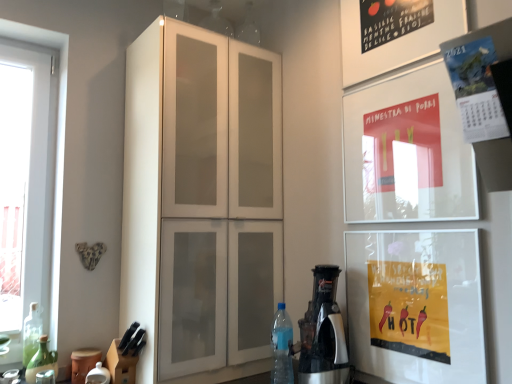
The width and height of the screenshot is (512, 384). What are the coordinates of `white matte cabinet at center` in the screenshot? It's located at (201, 200).

In order to face white glass window at left, should I rotate leftwards or rightwards?

To face it directly, rotate left by 28.444 degrees.

Describe the element at coordinates (477, 85) in the screenshot. I see `matte paper calendar at upper right, which is the first poster from front to back` at that location.

Find the location of a particular element. The image size is (512, 384). silver metallic coffee machine at lower right is located at coordinates (323, 333).

The height and width of the screenshot is (384, 512). Identify the location of blue translucent bottle at lower right, the 3th bottle viewed from the left. (282, 347).

Considering the sizes of objects matte paper poster at upper right, the 1th poster from the back, and silver metallic coffee machine at lower right in the image provided, who is thinner, matte paper poster at upper right, the 1th poster from the back, or silver metallic coffee machine at lower right?

Thinner between the two is matte paper poster at upper right, the 1th poster from the back.

The width and height of the screenshot is (512, 384). In order to click on coffee machine on the left side of matte paper poster at upper right, the 1th poster from the back in this screenshot , I will do `click(323, 333)`.

Is matte paper poster at upper right, which ranks as the second poster in front-to-back order, located outside silver metallic coffee machine at lower right?

Yes, matte paper poster at upper right, which ranks as the second poster in front-to-back order, is outside of silver metallic coffee machine at lower right.

Is blue translucent bottle at lower right, the 3th bottle viewed from the left, facing away from silver metallic coffee machine at lower right?

No, blue translucent bottle at lower right, the 3th bottle viewed from the left,'s orientation is not away from silver metallic coffee machine at lower right.

From the image's perspective, is blue translucent bottle at lower right, the 3th bottle viewed from the left, located beneath silver metallic coffee machine at lower right?

Yes, from the image's perspective, blue translucent bottle at lower right, the 3th bottle viewed from the left, is below silver metallic coffee machine at lower right.

Locate an element on the screen. The image size is (512, 384). coffee machine in front of the blue translucent bottle at lower right, the 3th bottle viewed from the left is located at coordinates (323, 333).

Considering the sizes of objects blue translucent bottle at lower right, which appears as the 1th bottle when viewed from the right, and silver metallic coffee machine at lower right in the image provided, who is bigger, blue translucent bottle at lower right, which appears as the 1th bottle when viewed from the right, or silver metallic coffee machine at lower right?

silver metallic coffee machine at lower right.

Is blue translucent bottle at lower right, which appears as the 1th bottle when viewed from the right, at the back of matte paper poster at upper right, the 1th poster from the back?

matte paper poster at upper right, the 1th poster from the back, is not turned away from blue translucent bottle at lower right, which appears as the 1th bottle when viewed from the right.

Does point (438, 80) come in front of point (288, 368)?

Yes, point (438, 80) is closer to viewer.

Between matte paper poster at upper right, which ranks as the second poster in front-to-back order, and blue translucent bottle at lower right, which appears as the 1th bottle when viewed from the right, which one has less height?

Standing shorter between the two is blue translucent bottle at lower right, which appears as the 1th bottle when viewed from the right.

Measure the distance between matte paper poster at upper right, which ranks as the second poster in front-to-back order, and blue translucent bottle at lower right, the 3th bottle viewed from the left.

matte paper poster at upper right, which ranks as the second poster in front-to-back order, and blue translucent bottle at lower right, the 3th bottle viewed from the left, are 28.86 inches apart from each other.

From a real-world perspective, is white glass window at left below silver metallic coffee machine at lower right?

No, from a real-world perspective, white glass window at left is not beneath silver metallic coffee machine at lower right.

Is white glass window at left bigger than silver metallic coffee machine at lower right?

Correct, white glass window at left is larger in size than silver metallic coffee machine at lower right.

Can we say white glass window at left lies outside silver metallic coffee machine at lower right?

white glass window at left is positioned outside silver metallic coffee machine at lower right.

Can you confirm if white glass window at left is wider than matte paper poster at upper right, the 1th poster from the back?

Correct, the width of white glass window at left exceeds that of matte paper poster at upper right, the 1th poster from the back.

How different are the orientations of white glass window at left and matte paper poster at upper right, the 1th poster from the back, in degrees?

The angle between the facing direction of white glass window at left and the facing direction of matte paper poster at upper right, the 1th poster from the back, is 88.6 degrees.

How distant is white glass window at left from matte paper poster at upper right, the 1th poster from the back?

white glass window at left is 4.80 feet from matte paper poster at upper right, the 1th poster from the back.

Based on the photo, can we say white glass window at left lies outside matte paper poster at upper right, the 1th poster from the back?

Yes, white glass window at left is not within matte paper poster at upper right, the 1th poster from the back.

Is blue translucent bottle at lower right, the 3th bottle viewed from the left, closer to camera compared to matte paper poster at upper right, which ranks as the second poster in front-to-back order?

No, the depth of blue translucent bottle at lower right, the 3th bottle viewed from the left, is greater than that of matte paper poster at upper right, which ranks as the second poster in front-to-back order.

Considering the relative sizes of blue translucent bottle at lower right, the 3th bottle viewed from the left, and matte paper poster at upper right, the 1th poster from the back, in the image provided, is blue translucent bottle at lower right, the 3th bottle viewed from the left, taller than matte paper poster at upper right, the 1th poster from the back,?

No.

What's the angular difference between blue translucent bottle at lower right, which appears as the 1th bottle when viewed from the right, and matte paper poster at upper right, the 1th poster from the back,'s facing directions?

blue translucent bottle at lower right, which appears as the 1th bottle when viewed from the right, and matte paper poster at upper right, the 1th poster from the back, are facing 0.494 degrees away from each other.

From the image's perspective, is blue translucent bottle at lower right, which appears as the 1th bottle when viewed from the right, below matte paper poster at upper right, which ranks as the second poster in front-to-back order?

Yes, from the image's perspective, blue translucent bottle at lower right, which appears as the 1th bottle when viewed from the right, is below matte paper poster at upper right, which ranks as the second poster in front-to-back order.

From a real-world perspective, is matte paper calendar at upper right, the second poster from the back, physically located above or below white matte cabinet at center?

Clearly, from a real-world perspective, matte paper calendar at upper right, the second poster from the back, is above white matte cabinet at center.

Which point is more forward, (492, 134) or (132, 123)?

Positioned in front is point (492, 134).

Is matte paper calendar at upper right, which is the first poster from front to back, shorter than white matte cabinet at center?

Correct, matte paper calendar at upper right, which is the first poster from front to back, is not as tall as white matte cabinet at center.

Where is `the 2nd poster in front when counting from the white matte cabinet at center`? The width and height of the screenshot is (512, 384). the 2nd poster in front when counting from the white matte cabinet at center is located at coordinates (477, 85).

At what (x,y) coordinates should I click in order to perform the action: click on the 1st poster in front of the silver metallic coffee machine at lower right, starting your count from the anchor. Please return your answer as a coordinate pair (x, y). Looking at the image, I should click on (407, 152).

Which bottle is the 1st one when counting from the left side of the silver metallic coffee machine at lower right? Please provide its 2D coordinates.

[(282, 347)]

Consider the image. When comparing their distances from matte paper poster at upper right, which ranks as the second poster in front-to-back order, does white glass window at left or green glass bottle at left, the 2th bottle when ordered from left to right, seem closer?

white glass window at left is positioned closer to the anchor matte paper poster at upper right, which ranks as the second poster in front-to-back order.

Based on their spatial positions, is white glass window at left or blue translucent bottle at lower right, which appears as the 1th bottle when viewed from the right, further from green glass bottle at lower left, the first bottle positioned from the left?

Based on the image, blue translucent bottle at lower right, which appears as the 1th bottle when viewed from the right, appears to be further to green glass bottle at lower left, the first bottle positioned from the left.

Which object lies nearer to the anchor point white glass window at left, white matte cabinet at center or blue translucent bottle at lower right, the 3th bottle viewed from the left?

Based on the image, white matte cabinet at center appears to be nearer to white glass window at left.

Based on their spatial positions, is green glass bottle at left, the second bottle when ordered from right to left, or matte paper calendar at upper right, the second poster from the back, closer to white glass window at left?

green glass bottle at left, the second bottle when ordered from right to left, is closer to white glass window at left.

From the image, which object appears to be farther from matte paper poster at upper right, the 1th poster from the back, blue translucent bottle at lower right, which appears as the 1th bottle when viewed from the right, or matte paper calendar at upper right, the second poster from the back?

blue translucent bottle at lower right, which appears as the 1th bottle when viewed from the right, lies further to matte paper poster at upper right, the 1th poster from the back, than the other object.

Looking at the image, which one is located further to silver metallic coffee machine at lower right, green glass bottle at lower left, the 3th bottle positioned from the right, or matte paper poster at upper right, which ranks as the second poster in front-to-back order?

green glass bottle at lower left, the 3th bottle positioned from the right.

Looking at the image, which one is located closer to blue translucent bottle at lower right, the 3th bottle viewed from the left, matte paper poster at upper right, which ranks as the second poster in front-to-back order, or green glass bottle at lower left, the 3th bottle positioned from the right?

matte paper poster at upper right, which ranks as the second poster in front-to-back order, is closer to blue translucent bottle at lower right, the 3th bottle viewed from the left.

Looking at the image, which one is located closer to green glass bottle at left, the 2th bottle when ordered from left to right, silver metallic coffee machine at lower right or green glass bottle at lower left, the first bottle positioned from the left?

green glass bottle at lower left, the first bottle positioned from the left.

At what (x,y) coordinates should I click in order to perform the action: click on poster between matte paper calendar at upper right, which is the first poster from front to back, and blue translucent bottle at lower right, which appears as the 1th bottle when viewed from the right, from top to bottom. Please return your answer as a coordinate pair (x, y). The image size is (512, 384). Looking at the image, I should click on (407, 152).

Image resolution: width=512 pixels, height=384 pixels. Find the location of `bottle located between green glass bottle at left, the 2th bottle when ordered from left to right, and silver metallic coffee machine at lower right in the left-right direction`. bottle located between green glass bottle at left, the 2th bottle when ordered from left to right, and silver metallic coffee machine at lower right in the left-right direction is located at coordinates (282, 347).

The height and width of the screenshot is (384, 512). Identify the location of coffee machine located between green glass bottle at left, the second bottle when ordered from right to left, and matte paper calendar at upper right, the second poster from the back, in the left-right direction. (323, 333).

Locate an element on the screen. Image resolution: width=512 pixels, height=384 pixels. cabinetry situated between white glass window at left and silver metallic coffee machine at lower right from left to right is located at coordinates (201, 200).